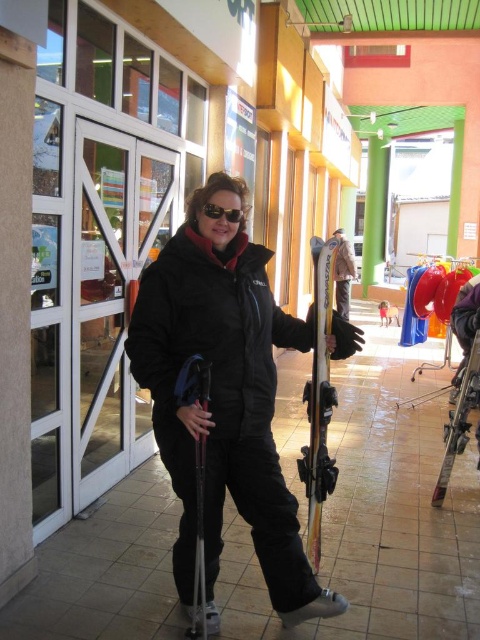
Question: Is black matte jacket at center to the right of black reflective sunglasses at center from the viewer's perspective?

Choices:
 (A) no
 (B) yes

Answer: (B)

Question: Which object is farther from the camera taking this photo?

Choices:
 (A) black matte jacket at center
 (B) black reflective sunglasses at center
 (C) shiny metallic skis at center

Answer: (C)

Question: Can you confirm if black matte jacket at center is positioned below black reflective sunglasses at center?

Choices:
 (A) no
 (B) yes

Answer: (B)

Question: Can you confirm if black matte jacket at center is positioned above shiny metallic skis at center?

Choices:
 (A) yes
 (B) no

Answer: (A)

Question: Which point is closer to the camera taking this photo?

Choices:
 (A) (189, 445)
 (B) (210, 208)
 (C) (316, 416)

Answer: (A)

Question: Which object is farther from the camera taking this photo?

Choices:
 (A) black reflective sunglasses at center
 (B) shiny metallic skis at center

Answer: (B)